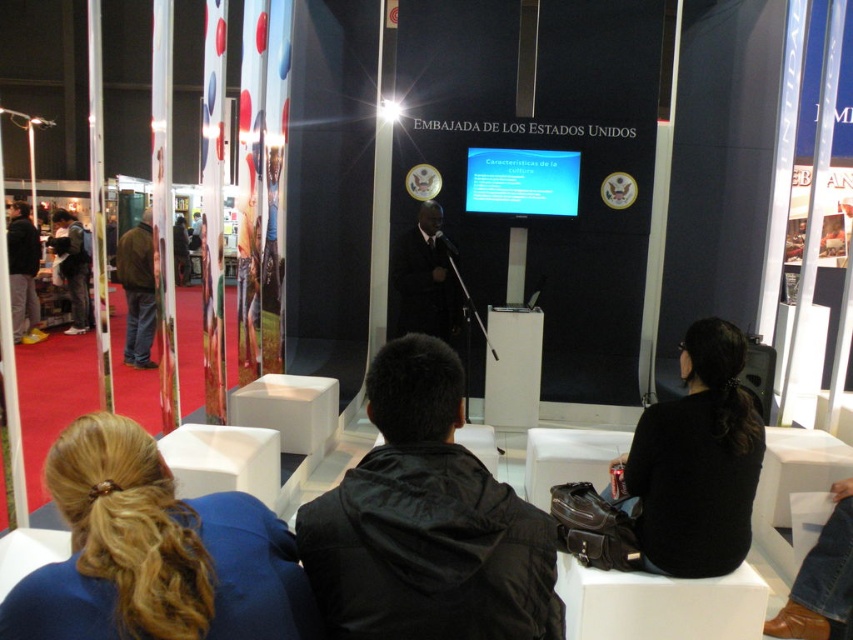
You are standing at the center of the room and want to pick up the black matte sweater at lower right. Which direction should you move to reach it?

Since the black matte sweater at lower right is located at point 0.722 on the x axis and 0.818 on the y axis, you should move to the right and slightly forward to reach it.

You are an attendee at this event and want to take a photo of the speaker. The speaker is standing in front of the matte blue screen at center. However, there is a brown leather jacket at left that might block your view. Based on their positions, can you see the speaker clearly through the space between the two objects?

The matte blue screen at center is located above the brown leather jacket at left, so the jacket is below the screen. Since the jacket is lower, it might block the lower part of the screen but the upper part remains visible. Therefore, you can still see the speaker partially through the space between the two objects.

You are an event planner who needs to set up a 10.5 feet wide banner between the matte blue screen at center and the brown leather jacket at left. Is there enough space between them to place the banner without moving any objects?

The distance between the matte blue screen at center and the brown leather jacket at left is 10.77 feet. Since the banner is 10.5 feet wide, there is sufficient space to place it between them without moving any objects.